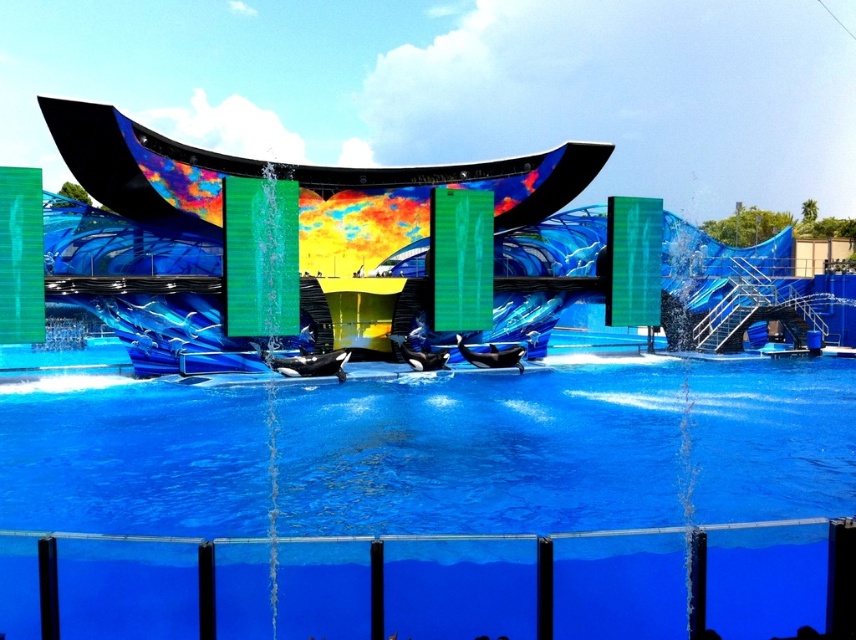
You are a performer preparing to jump from the shiny metallic stage at center into the blue smooth water at center. Will you land safely in the water?

The blue smooth water at center is positioned under the shiny metallic stage at center, so yes, you will land safely in the water.

You are a guest at the venue and want to take a photo of the shiny metallic stage at center. However, you notice that the blue smooth water at center might be blocking your view. Based on the scene description, can you determine if the water is between you and the stage?

The blue smooth water at center is closer to the viewer than the shiny metallic stage at center, so yes, the water is between you and the stage, blocking the view.

You are a performer preparing to jump from the shiny metallic stage at center into the blue smooth water at center. Can you safely land in the water without hitting the bottom?

The blue smooth water at center has a lesser height compared to the shiny metallic stage at center, which means the water is shallower than the stage. Therefore, landing in the water might not be safe as the depth may not be sufficient to prevent hitting the bottom.